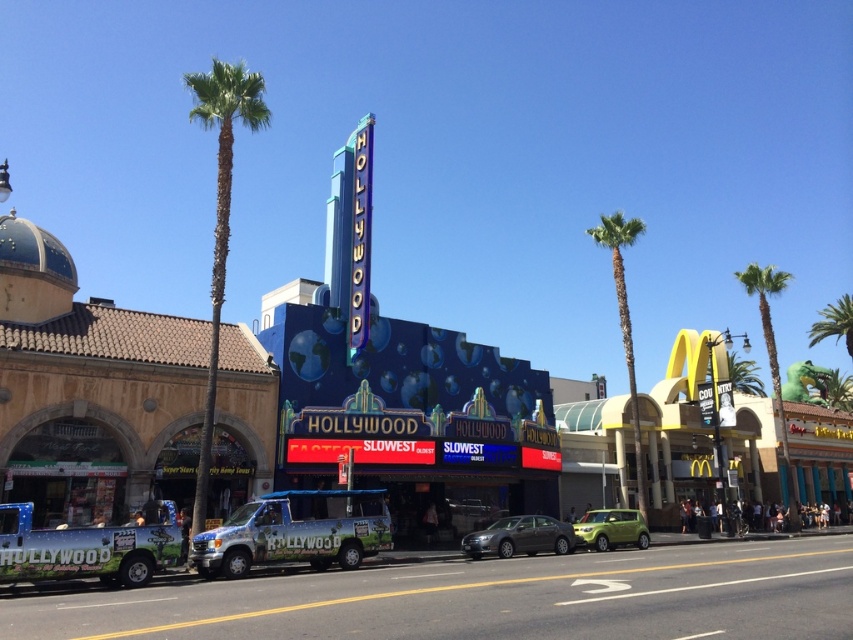
Which is in front, point (107, 304) or point (639, 538)?

Point (639, 538) is in front.

Is blue glossy theater at center smaller than green matte car at lower right?

Incorrect, blue glossy theater at center is not smaller in size than green matte car at lower right.

The image size is (853, 640). What do you see at coordinates (244, 396) in the screenshot? I see `blue glossy theater at center` at bounding box center [244, 396].

At what (x,y) coordinates should I click in order to perform the action: click on blue glossy theater at center. Please return your answer as a coordinate pair (x, y). Looking at the image, I should click on (244, 396).

Does green leafy palm tree at left appear over green leafy palm tree at center?

Yes.

The width and height of the screenshot is (853, 640). Identify the location of green leafy palm tree at left. (219, 212).

Who is more distant from viewer, (227, 116) or (560, 522)?

The point (560, 522) is behind.

Is green leafy palm tree at left further to camera compared to satin silver sedan at center?

No.

What do you see at coordinates (219, 212) in the screenshot? I see `green leafy palm tree at left` at bounding box center [219, 212].

Locate an element on the screen. This screenshot has width=853, height=640. green leafy palm tree at left is located at coordinates (219, 212).